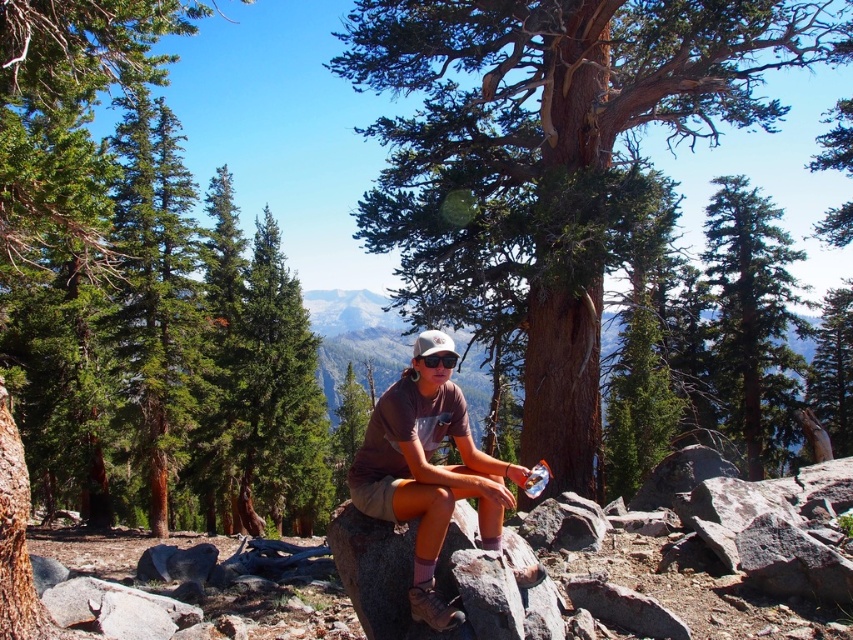
You are standing in the forest scene and want to move from the point at coordinates point (569,266) to the point at coordinates point (480,480). Which direction should you move to get closer to your destination?

You should move away from the viewer because point (569,266) is closer to the viewer than point (480,480). Moving away from the viewer would take you towards the destination.